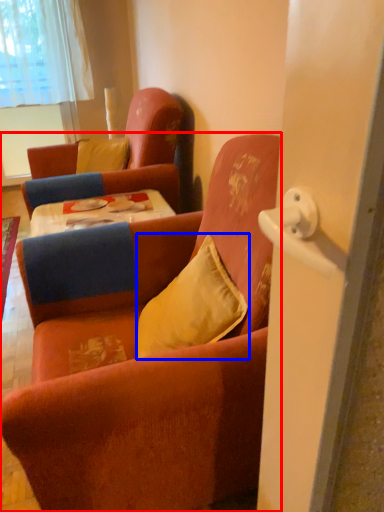
Question: Among these objects, which one is farthest to the camera, chair (highlighted by a red box) or pillow (highlighted by a blue box)?

Choices:
 (A) chair
 (B) pillow

Answer: (B)